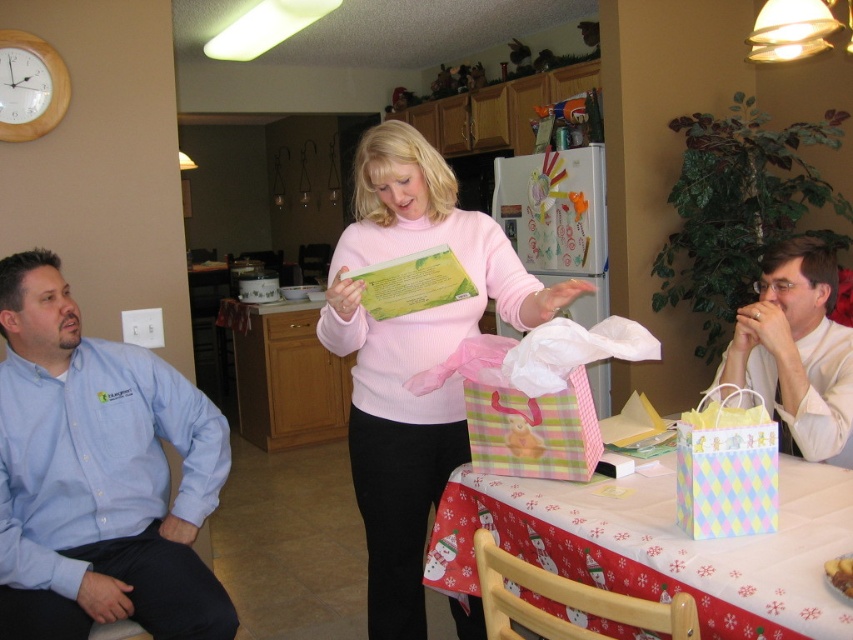
Question: Considering the real-world distances, which object is closest to the pink ribbed sweater at center?

Choices:
 (A) blue cotton shirt at left
 (B) yellow matte cake at center

Answer: (A)

Question: Which of the following is the closest to the observer?

Choices:
 (A) white glossy paper bag at right
 (B) pink ribbed sweater at center
 (C) blue cotton shirt at left

Answer: (B)

Question: Is blue cotton shirt at left further to camera compared to pastel diamond-patterned gift bag at lower center?

Choices:
 (A) no
 (B) yes

Answer: (B)

Question: Does white glossy paper bag at right have a smaller size compared to pastel diamond-patterned gift bag at lower right?

Choices:
 (A) no
 (B) yes

Answer: (A)

Question: From the image, what is the correct spatial relationship of blue cotton shirt at left in relation to white glossy paper bag at right?

Choices:
 (A) left
 (B) right

Answer: (A)

Question: Based on their relative distances, which object is nearer to the yellow matte cake at center?

Choices:
 (A) pastel diamond-patterned gift bag at lower center
 (B) blue cotton shirt at left
 (C) pink ribbed sweater at center

Answer: (A)